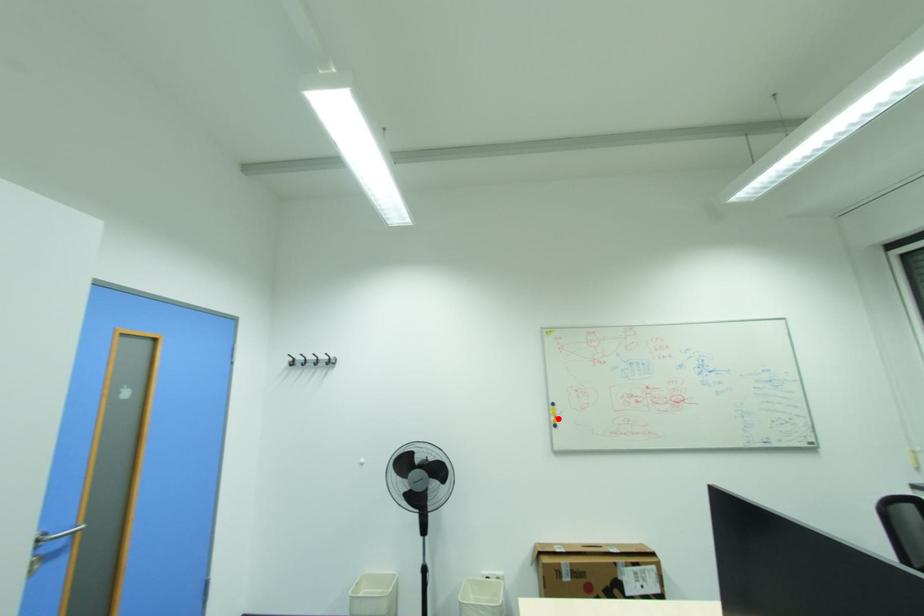
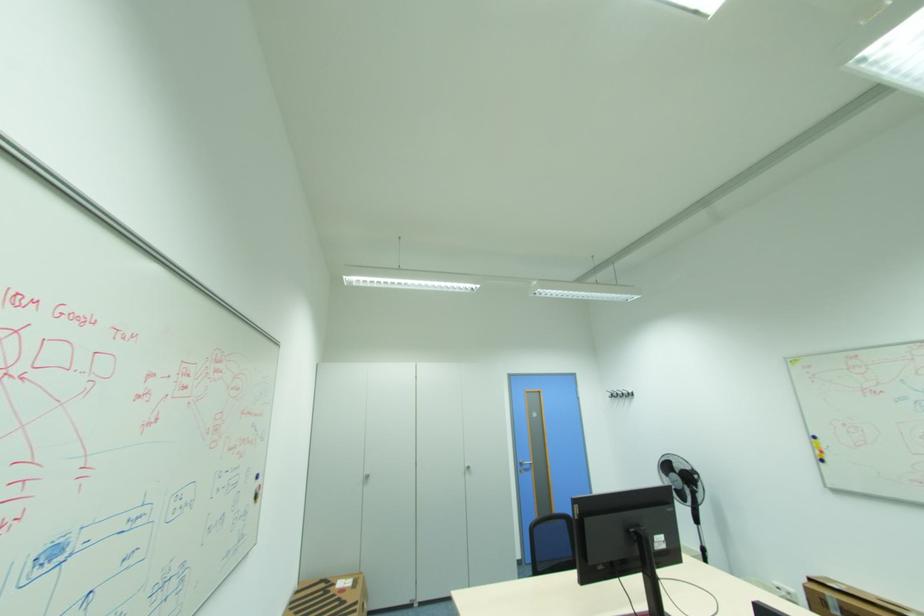
Question: I am providing you with two images of the same scene from different viewpoints. Image1 has a red point marked. In image2, the corresponding 3D location appears at what relative position? Reply with the corresponding letter.

Choices:
 (A) Closer
 (B) Farther

Answer: (A)